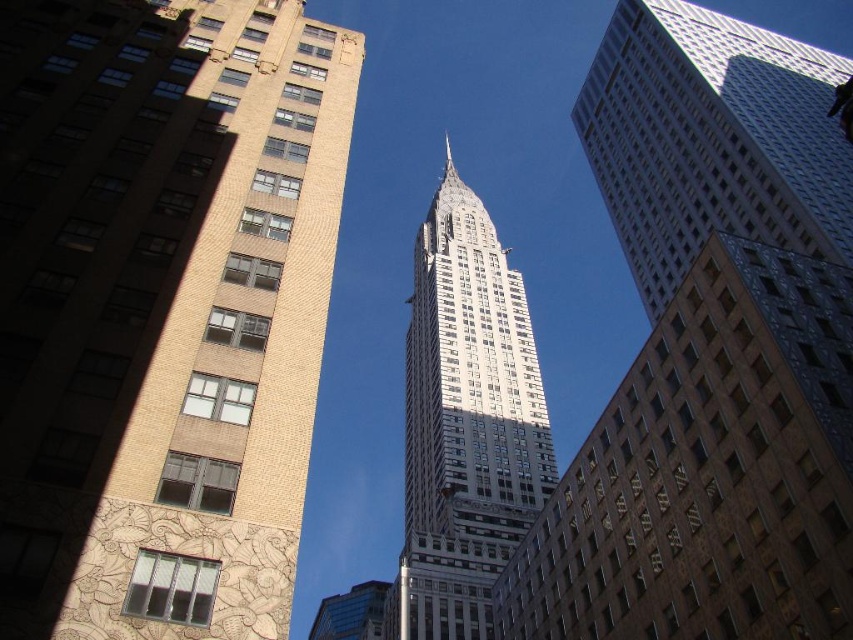
Question: Which point is closer to the camera?

Choices:
 (A) (355, 593)
 (B) (796, 99)
 (C) (526, 371)

Answer: (B)

Question: Where is white glass skyscraper at center located in relation to blue glass building at center in the image?

Choices:
 (A) below
 (B) above

Answer: (B)

Question: Which is farther from the white glass tower at center?

Choices:
 (A) yellow brick building at left
 (B) white glass skyscraper at center
 (C) blue glass building at center

Answer: (A)

Question: Estimate the real-world distances between objects in this image. Which object is farther from the blue glass building at center?

Choices:
 (A) white glass tower at center
 (B) yellow brick building at left
 (C) white glass skyscraper at center

Answer: (B)

Question: Can you confirm if yellow brick building at left is positioned to the left of white glass tower at center?

Choices:
 (A) no
 (B) yes

Answer: (B)

Question: Is white glass tower at center further to camera compared to blue glass building at center?

Choices:
 (A) no
 (B) yes

Answer: (A)